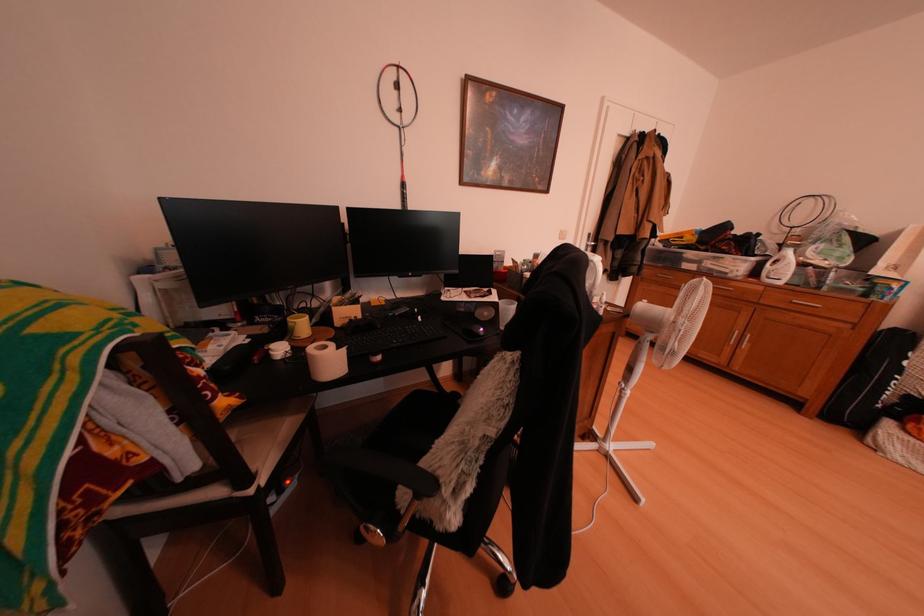
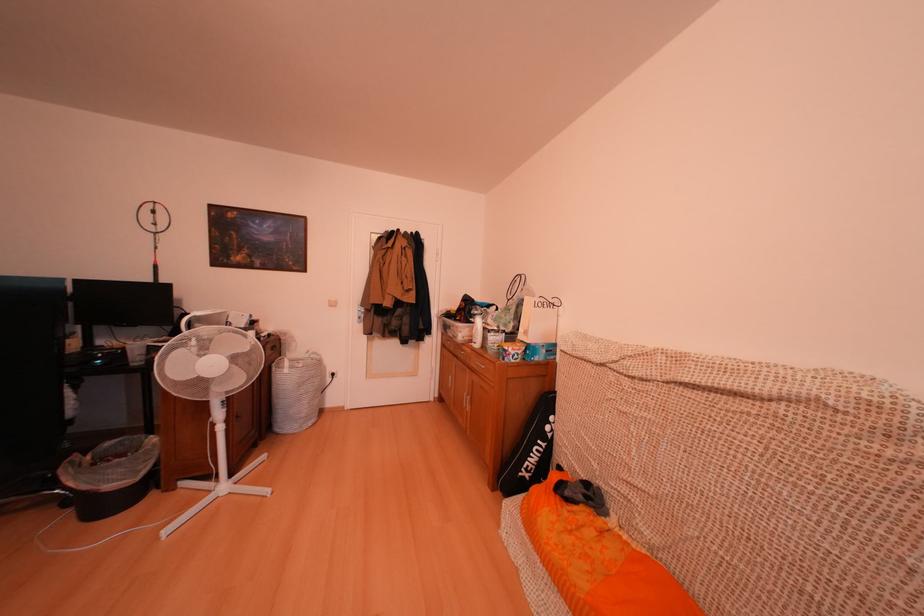
Question: What movement of the cameraman would produce the second image?

Choices:
 (A) Left
 (B) Right
 (C) Forward
 (D) Backward

Answer: (B)